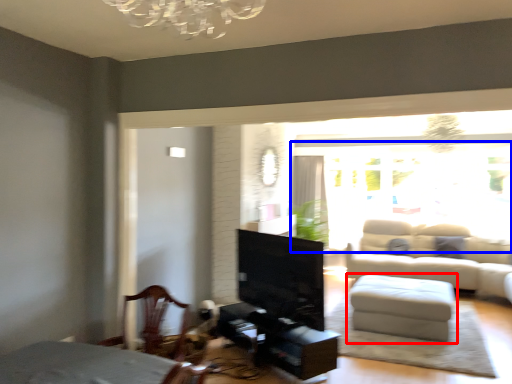
Question: Which object is closer to the camera taking this photo, table (highlighted by a red box) or window screen (highlighted by a blue box)?

Choices:
 (A) table
 (B) window screen

Answer: (A)